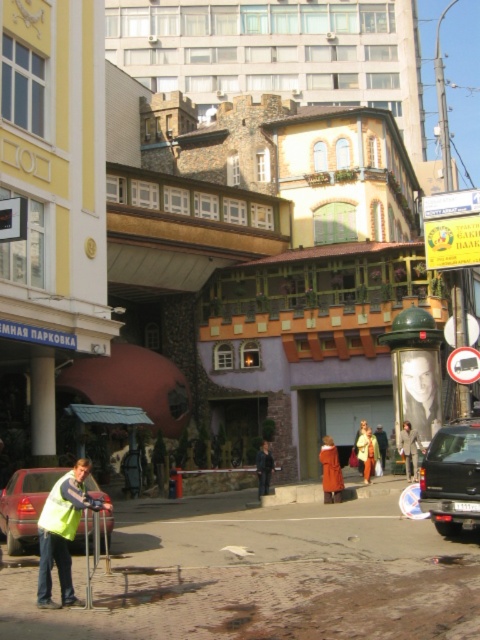
Question: Does yellow reflective vest at lower left appear on the right side of smooth gray portrait at center?

Choices:
 (A) no
 (B) yes

Answer: (A)

Question: Which of the following is the closest to the observer?

Choices:
 (A) (472, 456)
 (B) (44, 509)

Answer: (B)

Question: Does yellow reflective vest at lower left have a larger size compared to matte red car at lower left?

Choices:
 (A) yes
 (B) no

Answer: (B)

Question: Can you confirm if matte red car at lower left is thinner than yellow reflective safety vest at lower left?

Choices:
 (A) no
 (B) yes

Answer: (A)

Question: Which of the following is the farthest from the observer?

Choices:
 (A) (23, 493)
 (B) (433, 372)
 (C) (81, 502)

Answer: (B)

Question: Which point is farther to the camera?

Choices:
 (A) (41, 520)
 (B) (466, 428)

Answer: (B)